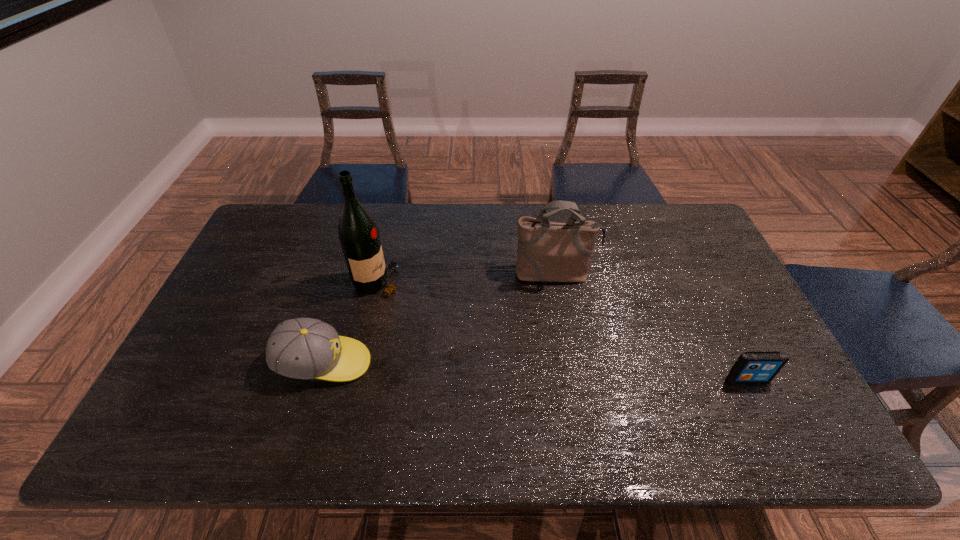
Image resolution: width=960 pixels, height=540 pixels. Identify the location of the tallest object. (358, 233).

In order to click on shoulder bag in this screenshot , I will do `click(547, 251)`.

You are a GUI agent. You are given a task and a screenshot of the screen. Output one action in this format:
    pyautogui.click(x=<x>, y=<y>)
    Task: Click on the third shortest object
    This screenshot has width=960, height=540.
    Given the screenshot: What is the action you would take?
    pyautogui.click(x=547, y=251)

At what (x,y) coordinates should I click in order to perform the action: click on the second shortest object. Please return your answer as a coordinate pair (x, y). This screenshot has width=960, height=540. Looking at the image, I should click on (302, 348).

At what (x,y) coordinates should I click in order to perform the action: click on iPod. Please return your answer as a coordinate pair (x, y). The height and width of the screenshot is (540, 960). Looking at the image, I should click on coord(752,366).

Locate an element on the screen. The height and width of the screenshot is (540, 960). the rightmost object is located at coordinates (752, 366).

At what (x,y) coordinates should I click in order to perform the action: click on vacant area situated 0.300m on the surface of the wine bottle. Please return your answer as a coordinate pair (x, y). This screenshot has width=960, height=540. Looking at the image, I should click on (501, 281).

You are a GUI agent. You are given a task and a screenshot of the screen. Output one action in this format:
    pyautogui.click(x=<x>, y=<y>)
    Task: Click on the vacant position located on the front-facing side of the second object from right to left
    The width and height of the screenshot is (960, 540).
    Given the screenshot: What is the action you would take?
    pyautogui.click(x=571, y=366)

Find the location of `free space located on the front-facing side of the third tallest object`. free space located on the front-facing side of the third tallest object is located at coordinates (467, 363).

Find the location of a particular element. The image size is (960, 540). free space located 0.170m on the front screen of the shortest object is located at coordinates (782, 451).